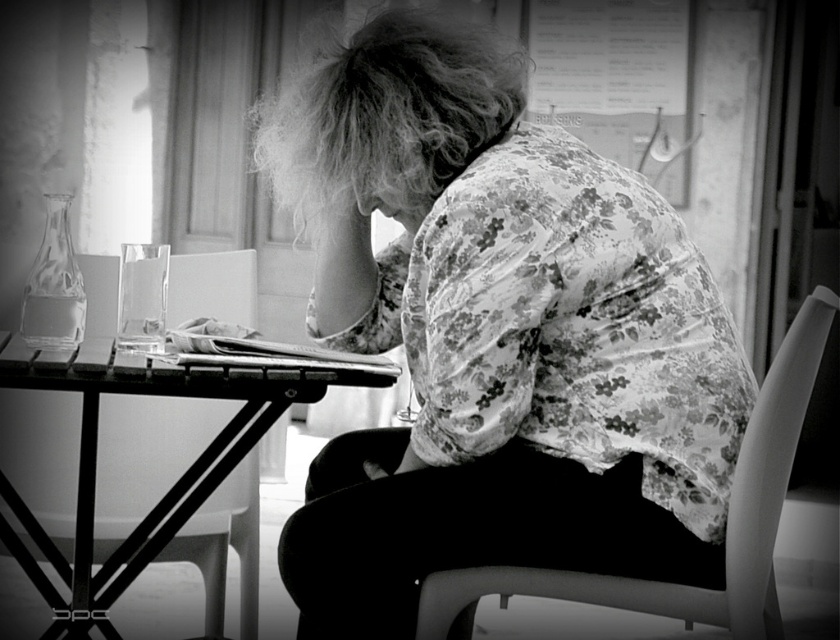
Who is shorter, smooth plastic chair at lower right or smooth skin hand at center?

Standing shorter between the two is smooth skin hand at center.

Does smooth plastic chair at lower right have a lesser height compared to smooth skin hand at center?

No.

At what (x,y) coordinates should I click in order to perform the action: click on smooth plastic chair at lower right. Please return your answer as a coordinate pair (x, y). This screenshot has height=640, width=840. Looking at the image, I should click on (726, 522).

Identify the location of smooth plastic chair at lower right. Image resolution: width=840 pixels, height=640 pixels. click(726, 522).

Does metallic table at center appear on the right side of smooth plastic chair at lower right?

No, metallic table at center is not to the right of smooth plastic chair at lower right.

Which is above, metallic table at center or smooth plastic chair at lower right?

Positioned higher is metallic table at center.

Is point (197, 637) positioned before point (785, 440)?

No, (197, 637) is behind (785, 440).

At what (x,y) coordinates should I click in order to perform the action: click on metallic table at center. Please return your answer as a coordinate pair (x, y). This screenshot has height=640, width=840. Looking at the image, I should click on (189, 467).

Can you confirm if fluffy hair at center is bigger than smooth skin hand at center?

Indeed, fluffy hair at center has a larger size compared to smooth skin hand at center.

Can you confirm if fluffy hair at center is smaller than smooth skin hand at center?

Incorrect, fluffy hair at center is not smaller in size than smooth skin hand at center.

You are a GUI agent. You are given a task and a screenshot of the screen. Output one action in this format:
    pyautogui.click(x=<x>, y=<y>)
    Task: Click on the fluffy hair at center
    The width and height of the screenshot is (840, 640).
    Given the screenshot: What is the action you would take?
    pyautogui.click(x=391, y=116)